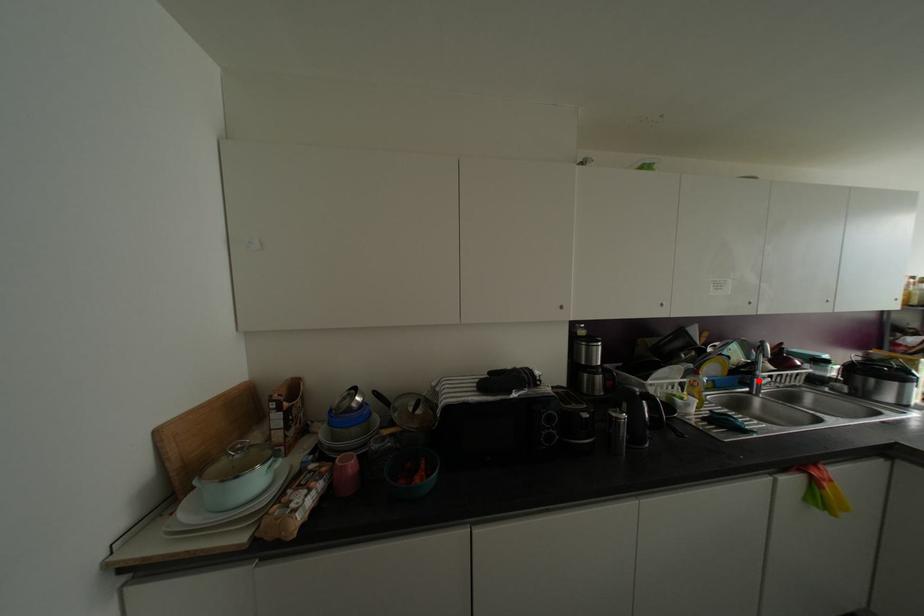
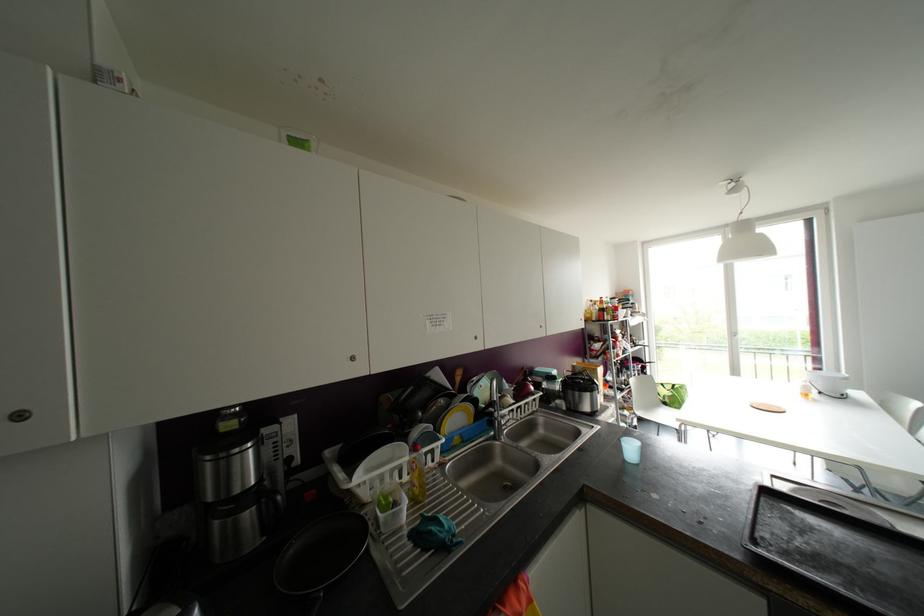
Find the pixel in the second image that matches the highlighted location in the first image.

(499, 422)